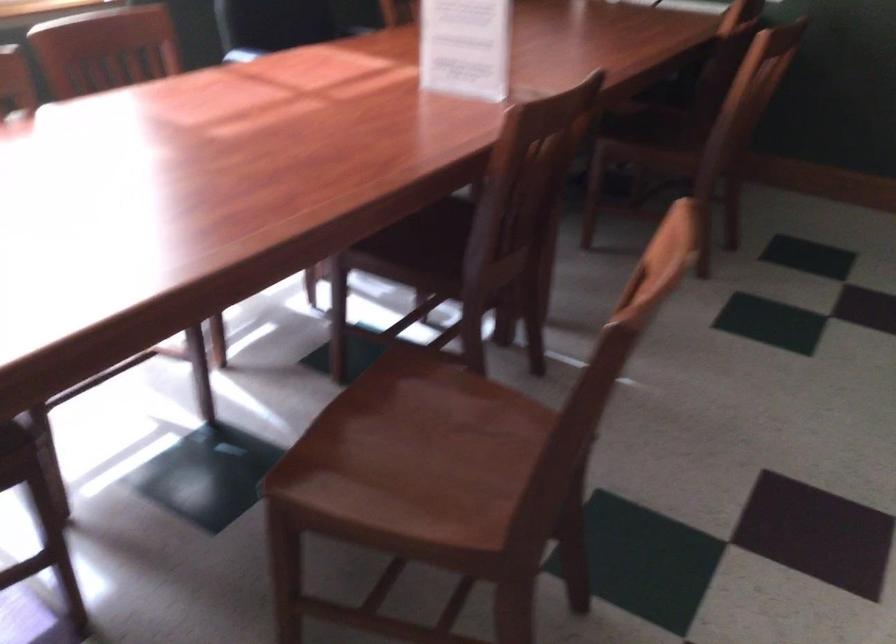
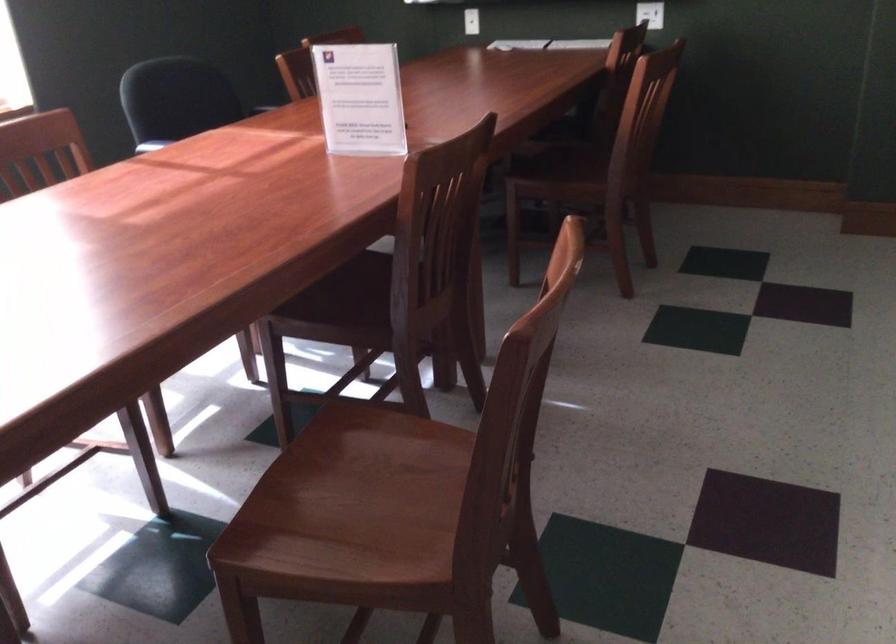
Where in the second image is the point corresponding to [657,122] from the first image?

(561, 158)